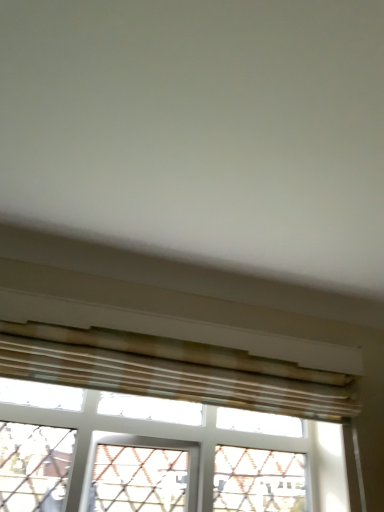
Question: Should I look upward or downward to see translucent glass window at center?

Choices:
 (A) down
 (B) up

Answer: (A)